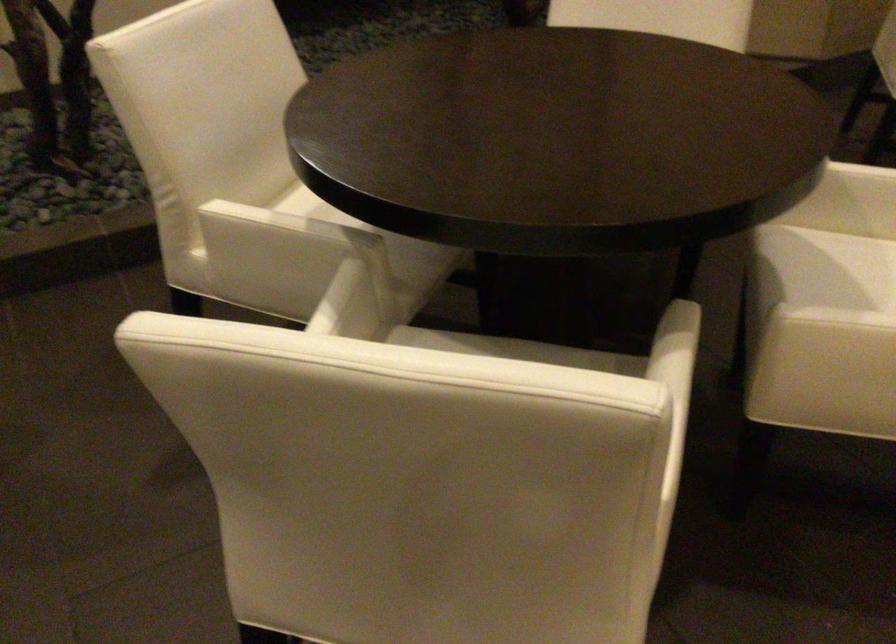
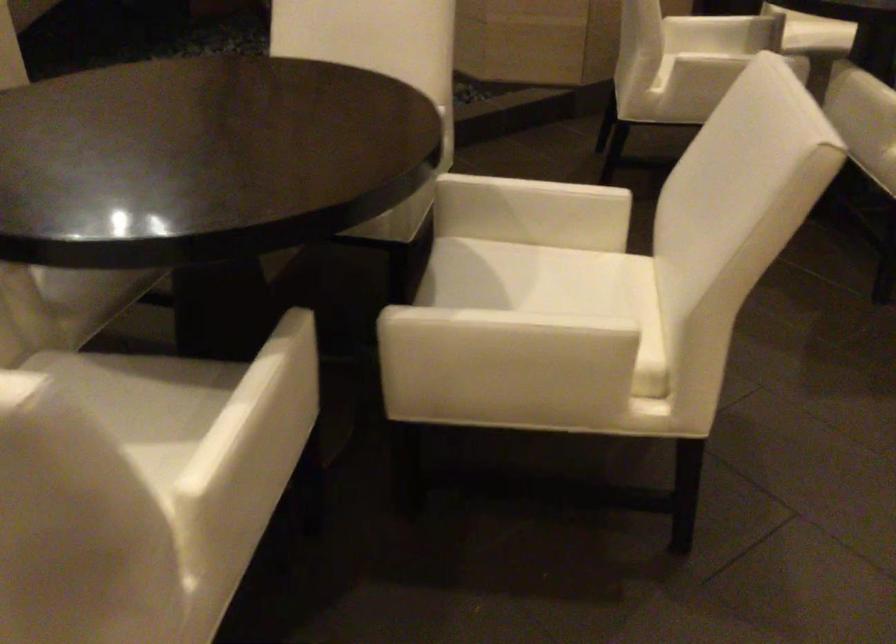
In the second image, find the point that corresponds to the point at 685,412 in the first image.

(299, 413)